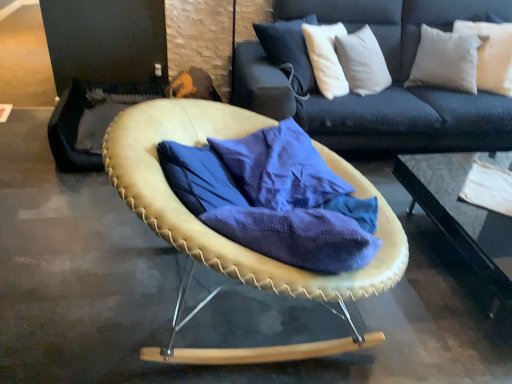
Identify the location of transparent glass table at center. (464, 226).

The height and width of the screenshot is (384, 512). Describe the element at coordinates (490, 54) in the screenshot. I see `white soft pillow at upper right` at that location.

The width and height of the screenshot is (512, 384). Describe the element at coordinates (275, 198) in the screenshot. I see `blue textured fabric at center` at that location.

Measure the distance between point (265, 135) and camera.

Point (265, 135) and camera are 1.74 meters apart.

Where is `transparent glass table at center`? This screenshot has height=384, width=512. transparent glass table at center is located at coordinates (464, 226).

From the image's perspective, who appears lower, white soft pillow at upper right or blue textured fabric at center?

blue textured fabric at center is shown below in the image.

This screenshot has width=512, height=384. In order to click on pillow lying on the right of blue textured fabric at center in this screenshot , I will do `click(490, 54)`.

Is white soft pillow at upper right at the left side of blue textured fabric at center?

No.

From a real-world perspective, which object stands above the other?

In real-world perspective, white soft pillow at upper right is above.

In order to click on pillow above the transparent glass table at center (from the image's perspective) in this screenshot , I will do `click(490, 54)`.

Relative to transparent glass table at center, is white soft pillow at upper right in front or behind?

In the image, white soft pillow at upper right appears behind transparent glass table at center.

Can you tell me how much transparent glass table at center and leather-like tan chair at center differ in facing direction?

101 degrees separate the facing orientations of transparent glass table at center and leather-like tan chair at center.

Can you confirm if transparent glass table at center is shorter than leather-like tan chair at center?

Indeed, transparent glass table at center has a lesser height compared to leather-like tan chair at center.

Considering the sizes of objects transparent glass table at center and leather-like tan chair at center in the image provided, who is smaller, transparent glass table at center or leather-like tan chair at center?

With smaller size is leather-like tan chair at center.

Which is behind, point (506, 326) or point (315, 287)?

The point (506, 326) is farther.

Is transparent glass table at center turned away from white soft pillow at upper right?

No, transparent glass table at center's orientation is not away from white soft pillow at upper right.

From the image's perspective, which object appears higher, transparent glass table at center or white soft pillow at upper right?

white soft pillow at upper right, from the image's perspective.

Considering the positions of objects transparent glass table at center and white soft pillow at upper right in the image provided, who is more to the left, transparent glass table at center or white soft pillow at upper right?

Positioned to the left is transparent glass table at center.

Does point (496, 247) come in front of point (510, 54)?

That is True.

Considering the sizes of blue textured fabric at center and transparent glass table at center in the image, is blue textured fabric at center taller or shorter than transparent glass table at center?

Clearly, blue textured fabric at center is taller compared to transparent glass table at center.

Measure the distance from blue textured fabric at center to transparent glass table at center.

blue textured fabric at center is 8.65 feet from transparent glass table at center.

Which object is positioned more to the right, blue textured fabric at center or transparent glass table at center?

transparent glass table at center is more to the right.

Do you think blue textured fabric at center is within transparent glass table at center, or outside of it?

blue textured fabric at center is not enclosed by transparent glass table at center.

Based on the photo, is leather-like tan chair at center completely or partially outside of white soft pillow at upper right?

leather-like tan chair at center lies outside white soft pillow at upper right's area.

The image size is (512, 384). What are the coordinates of `pillow that is on the right side of leather-like tan chair at center` in the screenshot? It's located at (490, 54).

Consider the image. In the image, is leather-like tan chair at center positioned in front of or behind white soft pillow at upper right?

leather-like tan chair at center is positioned closer to the viewer than white soft pillow at upper right.

Does point (326, 151) come in front of point (477, 61)?

Yes, point (326, 151) is in front of point (477, 61).

Looking at the image, does leather-like tan chair at center seem bigger or smaller compared to transparent glass table at center?

Clearly, leather-like tan chair at center is smaller in size than transparent glass table at center.

Is the position of leather-like tan chair at center more distant than that of transparent glass table at center?

That is False.

How much distance is there between leather-like tan chair at center and transparent glass table at center?

A distance of 2.70 meters exists between leather-like tan chair at center and transparent glass table at center.

Between leather-like tan chair at center and transparent glass table at center, which one has larger width?

With larger width is transparent glass table at center.

Locate an element on the screen. The image size is (512, 384). pillow on the right of blue textured fabric at center is located at coordinates (490, 54).

Find the location of a particular element. This screenshot has height=384, width=512. pillow positioned vertically above the transparent glass table at center (from a real-world perspective) is located at coordinates (490, 54).

Considering their positions, is white soft pillow at upper right positioned further to leather-like tan chair at center than blue textured fabric at center?

Based on the image, white soft pillow at upper right appears to be further to leather-like tan chair at center.

When comparing their distances from leather-like tan chair at center, does white soft pillow at upper right or transparent glass table at center seem closer?

The object closer to leather-like tan chair at center is white soft pillow at upper right.

Which object lies nearer to the anchor point white soft pillow at upper right, blue textured fabric at center or transparent glass table at center?

transparent glass table at center is positioned closer to the anchor white soft pillow at upper right.

When comparing their distances from white soft pillow at upper right, does transparent glass table at center or leather-like tan chair at center seem closer?

Among the two, transparent glass table at center is located nearer to white soft pillow at upper right.

Looking at the image, which one is located further to leather-like tan chair at center, blue textured fabric at center or white soft pillow at upper right?

white soft pillow at upper right is further to leather-like tan chair at center.

When comparing their distances from leather-like tan chair at center, does transparent glass table at center or blue textured fabric at center seem closer?

Based on the image, blue textured fabric at center appears to be nearer to leather-like tan chair at center.

Looking at the image, which one is located further to white soft pillow at upper right, leather-like tan chair at center or transparent glass table at center?

Among the two, leather-like tan chair at center is located further to white soft pillow at upper right.

Considering their positions, is transparent glass table at center positioned closer to leather-like tan chair at center than white soft pillow at upper right?

Among the two, white soft pillow at upper right is located nearer to leather-like tan chair at center.

Find the location of `chair between blue textured fabric at center and transparent glass table at center`. chair between blue textured fabric at center and transparent glass table at center is located at coordinates (212, 230).

This screenshot has width=512, height=384. Identify the location of chair between blue textured fabric at center and white soft pillow at upper right in the horizontal direction. (212, 230).

Identify the location of table between blue textured fabric at center and white soft pillow at upper right. (464, 226).

Find the location of a particular element. The height and width of the screenshot is (384, 512). table between leather-like tan chair at center and white soft pillow at upper right in the front-back direction is located at coordinates (464, 226).